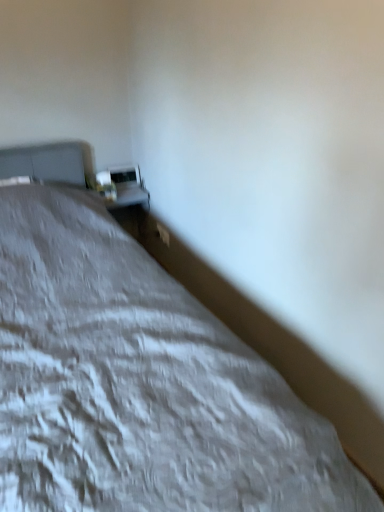
Question: Is matte white table lamp at upper left wider than white textured bed at center?

Choices:
 (A) yes
 (B) no

Answer: (B)

Question: Is matte white table lamp at upper left at the left side of white textured bed at center?

Choices:
 (A) yes
 (B) no

Answer: (A)

Question: From a real-world perspective, is matte white table lamp at upper left below white textured bed at center?

Choices:
 (A) no
 (B) yes

Answer: (A)

Question: Is matte white table lamp at upper left closer to the viewer compared to white textured bed at center?

Choices:
 (A) yes
 (B) no

Answer: (B)

Question: Is matte white table lamp at upper left behind white textured bed at center?

Choices:
 (A) yes
 (B) no

Answer: (A)

Question: Considering the positions of white glossy table at upper center and white textured bed at center in the image, is white glossy table at upper center wider or thinner than white textured bed at center?

Choices:
 (A) thin
 (B) wide

Answer: (A)

Question: From a real-world perspective, is white glossy table at upper center above or below white textured bed at center?

Choices:
 (A) below
 (B) above

Answer: (A)

Question: Relative to white textured bed at center, is white glossy table at upper center in front or behind?

Choices:
 (A) front
 (B) behind

Answer: (B)

Question: From the image's perspective, is white glossy table at upper center located above or below white textured bed at center?

Choices:
 (A) below
 (B) above

Answer: (B)

Question: Is white textured bed at center to the left or to the right of white glossy table at upper center in the image?

Choices:
 (A) left
 (B) right

Answer: (B)

Question: In terms of width, does white textured bed at center look wider or thinner when compared to white glossy table at upper center?

Choices:
 (A) thin
 (B) wide

Answer: (B)

Question: Is white textured bed at center situated inside white glossy table at upper center or outside?

Choices:
 (A) outside
 (B) inside

Answer: (A)

Question: Considering their positions, is white textured bed at center located in front of or behind white glossy table at upper center?

Choices:
 (A) behind
 (B) front

Answer: (B)

Question: From the image's perspective, is white glossy table at upper center above or below matte white table lamp at upper left?

Choices:
 (A) above
 (B) below

Answer: (B)

Question: Considering the positions of white glossy table at upper center and matte white table lamp at upper left in the image, is white glossy table at upper center wider or thinner than matte white table lamp at upper left?

Choices:
 (A) wide
 (B) thin

Answer: (A)